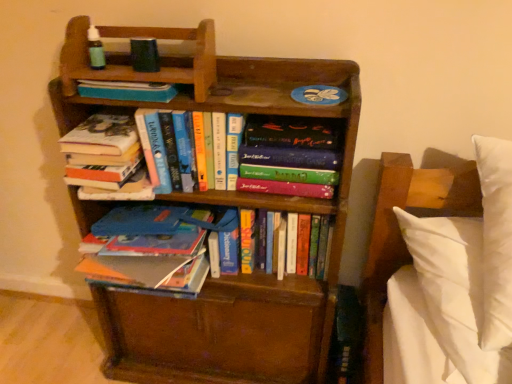
The height and width of the screenshot is (384, 512). Describe the element at coordinates (223, 204) in the screenshot. I see `wooden bookcase at center` at that location.

The width and height of the screenshot is (512, 384). What do you see at coordinates (208, 150) in the screenshot?
I see `hardcover book at center, acting as the 3th book starting from the left` at bounding box center [208, 150].

This screenshot has width=512, height=384. I want to click on hardcover books at center, which is the first book from left to right, so click(106, 159).

From the image's perspective, which one is positioned higher, hardcover book at upper center, the 2th book positioned from the left, or hardcover book at center, placed as the third book when sorted from right to left?

hardcover book at upper center, the 2th book positioned from the left.

How different are the orientations of hardcover book at upper center, the 2th book positioned from the left, and hardcover book at center, placed as the third book when sorted from right to left, in degrees?

The angle between the facing direction of hardcover book at upper center, the 2th book positioned from the left, and the facing direction of hardcover book at center, placed as the third book when sorted from right to left, is 1.41 degrees.

Is hardcover book at upper center, the 2th book positioned from the left, not close to hardcover book at center, placed as the third book when sorted from right to left?

No, hardcover book at upper center, the 2th book positioned from the left, is not far away from hardcover book at center, placed as the third book when sorted from right to left.

Where is `the 1st book to the right when counting from the hardcover book at upper center, positioned as the fourth book in right-to-left order`? The width and height of the screenshot is (512, 384). the 1st book to the right when counting from the hardcover book at upper center, positioned as the fourth book in right-to-left order is located at coordinates tap(208, 150).

Which is behind, point (106, 94) or point (78, 128)?

The point (78, 128) is behind.

How much distance is there between hardcover book at upper center, the 2th book positioned from the left, and hardcover books at center, which is the first book from left to right?

hardcover book at upper center, the 2th book positioned from the left, is 4.89 inches away from hardcover books at center, which is the first book from left to right.

Looking at this image, considering the positions of objects hardcover book at upper center, the 2th book positioned from the left, and hardcover books at center, the fifth book from the right, in the image provided, who is more to the right, hardcover book at upper center, the 2th book positioned from the left, or hardcover books at center, the fifth book from the right,?

hardcover book at upper center, the 2th book positioned from the left, is more to the right.

Is hardcover book at upper center, the 2th book positioned from the left, facing towards hardcover books at center, the fifth book from the right?

No, hardcover book at upper center, the 2th book positioned from the left, is not aimed at hardcover books at center, the fifth book from the right.

From the image's perspective, which is below, hardcover book at center, marked as the 1th book in a right-to-left arrangement, or hardcover book at upper center, positioned as the fourth book in right-to-left order?

From the image's view, hardcover book at center, marked as the 1th book in a right-to-left arrangement, is below.

From a real-world perspective, count 2nd books downward from the hardcover book at upper center, the 2th book positioned from the left, and point to it. Please provide its 2D coordinates.

[(290, 151)]

Is hardcover book at center, the 5th book when ordered from left to right, in front of or behind hardcover book at upper center, the 2th book positioned from the left, in the image?

Clearly, hardcover book at center, the 5th book when ordered from left to right, is behind hardcover book at upper center, the 2th book positioned from the left.

From a real-world perspective, is hardcover book at center, the 5th book when ordered from left to right, over hardcover book at upper center, positioned as the fourth book in right-to-left order?

Incorrect, from a real-world perspective, hardcover book at center, the 5th book when ordered from left to right, is lower than hardcover book at upper center, positioned as the fourth book in right-to-left order.

From the image's perspective, which one is positioned higher, hardcover book at center, which appears as the fourth book when viewed from the left, or wooden bookcase at center?

wooden bookcase at center.

Does hardcover book at center, which appears as the fourth book when viewed from the left, turn towards wooden bookcase at center?

Yes, hardcover book at center, which appears as the fourth book when viewed from the left, is turned towards wooden bookcase at center.

From a real-world perspective, relative to wooden bookcase at center, is hardcover book at center, which appears as the fourth book when viewed from the left, vertically above or below?

hardcover book at center, which appears as the fourth book when viewed from the left, is above wooden bookcase at center.

Which object is closer to the camera, hardcover book at center, the 2th book positioned from the right, or wooden bookcase at center?

wooden bookcase at center is in front.

Which is in front, point (159, 163) or point (115, 154)?

The point (115, 154) is closer.

Does hardcover book at center, acting as the 3th book starting from the left, touch hardcover books at center, which is the first book from left to right?

There is a gap between hardcover book at center, acting as the 3th book starting from the left, and hardcover books at center, which is the first book from left to right.

Is hardcover books at center, the fifth book from the right, inside hardcover book at center, placed as the third book when sorted from right to left?

That's incorrect, hardcover books at center, the fifth book from the right, is not inside hardcover book at center, placed as the third book when sorted from right to left.

From the image's perspective, is hardcover book at center, acting as the 3th book starting from the left, on top of hardcover books at center, which is the first book from left to right?

Yes, from the image's perspective, hardcover book at center, acting as the 3th book starting from the left, is on top of hardcover books at center, which is the first book from left to right.

Would you consider wooden bookcase at center to be distant from hardcover book at center, the 5th book when ordered from left to right?

That's not correct — wooden bookcase at center is a little close to hardcover book at center, the 5th book when ordered from left to right.

Where is `bookcase located below the hardcover book at center, marked as the 1th book in a right-to-left arrangement (from the image's perspective)`? The height and width of the screenshot is (384, 512). bookcase located below the hardcover book at center, marked as the 1th book in a right-to-left arrangement (from the image's perspective) is located at coordinates (223, 204).

Is point (125, 300) closer or farther from the camera than point (281, 170)?

Point (125, 300) is positioned farther from the camera compared to point (281, 170).

From the image's perspective, which object appears higher, wooden bookcase at center or hardcover book at center, marked as the 1th book in a right-to-left arrangement?

hardcover book at center, marked as the 1th book in a right-to-left arrangement, from the image's perspective.

Is hardcover book at center, acting as the 3th book starting from the left, facing away from wooden bookcase at center?

That's right, hardcover book at center, acting as the 3th book starting from the left, is facing away from wooden bookcase at center.

How different are the orientations of hardcover book at center, placed as the third book when sorted from right to left, and wooden bookcase at center in degrees?

The facing directions of hardcover book at center, placed as the third book when sorted from right to left, and wooden bookcase at center are 2.27 degrees apart.

Is hardcover book at center, placed as the third book when sorted from right to left, outside of wooden bookcase at center?

Actually, hardcover book at center, placed as the third book when sorted from right to left, is at least partially inside wooden bookcase at center.

Measure the distance from hardcover book at center, placed as the third book when sorted from right to left, to wooden bookcase at center.

A distance of 9.96 inches exists between hardcover book at center, placed as the third book when sorted from right to left, and wooden bookcase at center.

Find the location of `the 1st book counting from the left of the hardcover book at center, placed as the third book when sorted from right to left`. the 1st book counting from the left of the hardcover book at center, placed as the third book when sorted from right to left is located at coordinates (127, 91).

In order to click on book that is the 2nd object located above the hardcover books at center, the fifth book from the right (from the image's perspective) in this screenshot , I will do (127, 91).

Based on their spatial positions, is wooden bookcase at center or hardcover books at center, the fifth book from the right, further from hardcover book at center, acting as the 3th book starting from the left?

wooden bookcase at center is positioned further to the anchor hardcover book at center, acting as the 3th book starting from the left.

Based on their spatial positions, is wooden bookcase at center or hardcover book at center, placed as the third book when sorted from right to left, further from hardcover book at center, marked as the 1th book in a right-to-left arrangement?

wooden bookcase at center is further to hardcover book at center, marked as the 1th book in a right-to-left arrangement.

From the image, which object appears to be farther from hardcover books at center, which is the first book from left to right, hardcover book at center, the 5th book when ordered from left to right, or hardcover book at center, placed as the third book when sorted from right to left?

hardcover book at center, the 5th book when ordered from left to right, lies further to hardcover books at center, which is the first book from left to right, than the other object.

Considering their positions, is hardcover book at center, which appears as the fourth book when viewed from the left, positioned further to hardcover book at center, placed as the third book when sorted from right to left, than hardcover books at center, the fifth book from the right?

hardcover book at center, which appears as the fourth book when viewed from the left, is positioned further to the anchor hardcover book at center, placed as the third book when sorted from right to left.

Estimate the real-world distances between objects in this image. Which object is closer to hardcover book at center, the 2th book positioned from the right, hardcover book at center, the 5th book when ordered from left to right, or hardcover book at center, acting as the 3th book starting from the left?

Based on the image, hardcover book at center, the 5th book when ordered from left to right, appears to be nearer to hardcover book at center, the 2th book positioned from the right.

Based on their spatial positions, is hardcover book at center, acting as the 3th book starting from the left, or hardcover books at center, the fifth book from the right, further from hardcover book at center, marked as the 1th book in a right-to-left arrangement?

A: The object further to hardcover book at center, marked as the 1th book in a right-to-left arrangement, is hardcover books at center, the fifth book from the right.

When comparing their distances from hardcover book at center, which appears as the fourth book when viewed from the left, does hardcover book at upper center, positioned as the fourth book in right-to-left order, or hardcover books at center, the fifth book from the right, seem further?

The object further to hardcover book at center, which appears as the fourth book when viewed from the left, is hardcover book at upper center, positioned as the fourth book in right-to-left order.

Estimate the real-world distances between objects in this image. Which object is further from hardcover book at center, the 2th book positioned from the right, hardcover book at center, marked as the 1th book in a right-to-left arrangement, or wooden bookcase at center?

wooden bookcase at center lies further to hardcover book at center, the 2th book positioned from the right, than the other object.

You are a GUI agent. You are given a task and a screenshot of the screen. Output one action in this format:
    pyautogui.click(x=<x>, y=<y>)
    Task: Click on the bookcase situated between hardcover book at upper center, positioned as the fourth book in right-to-left order, and hardcover book at center, marked as the 1th book in a right-to-left arrangement, from left to right
    This screenshot has width=512, height=384.
    Given the screenshot: What is the action you would take?
    pyautogui.click(x=223, y=204)

I want to click on book between hardcover books at center, the fifth book from the right, and hardcover book at center, acting as the 3th book starting from the left, from left to right, so click(127, 91).

Identify the location of bookcase between hardcover book at upper center, positioned as the fourth book in right-to-left order, and hardcover book at center, the 2th book positioned from the right, vertically. (223, 204).

The width and height of the screenshot is (512, 384). I want to click on bookcase between hardcover books at center, the fifth book from the right, and hardcover book at center, which appears as the fourth book when viewed from the left, so 223,204.